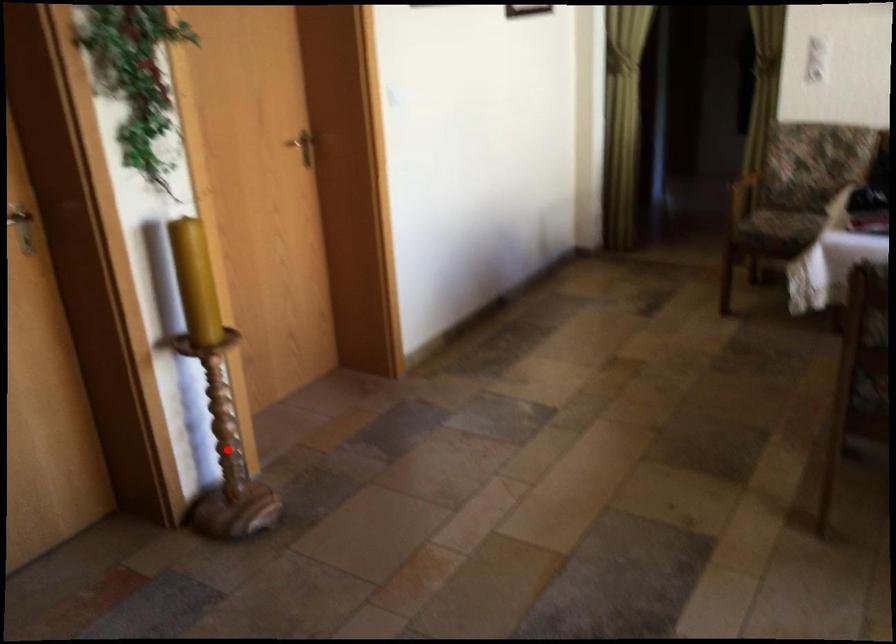
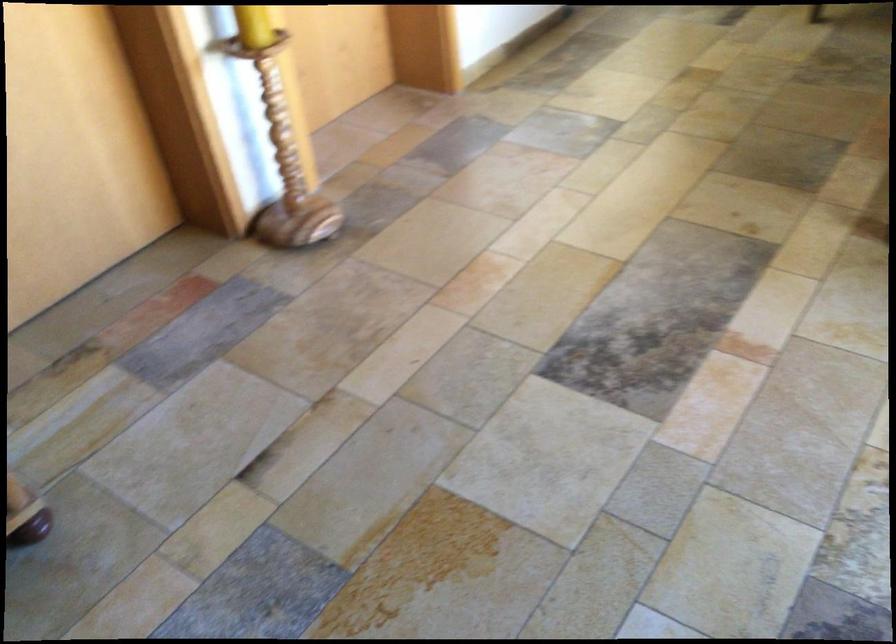
Find the pixel in the second image that matches the highlighted location in the first image.

(283, 162)